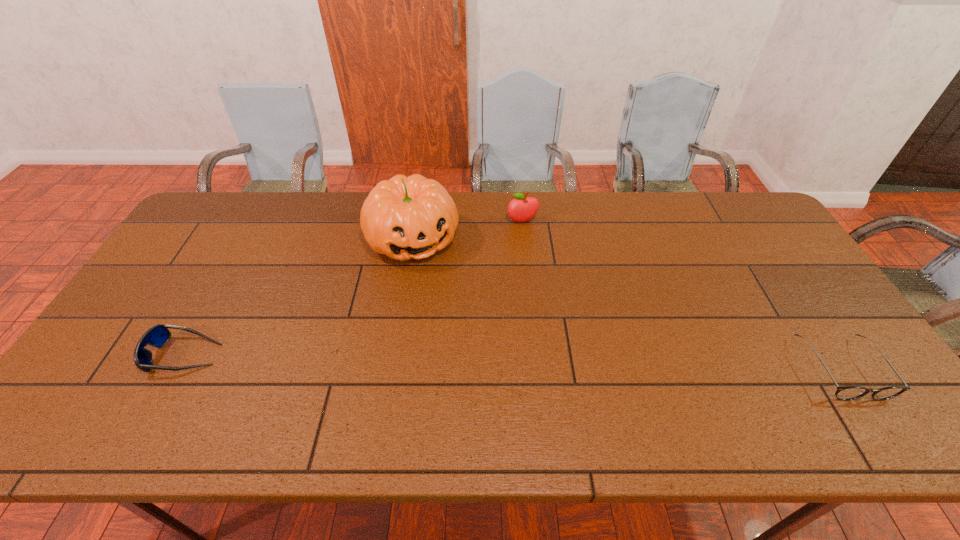
In order to click on object that is at the right edge in this screenshot , I will do `click(845, 393)`.

Find the location of a particular element. This screenshot has height=540, width=960. object at the near left corner is located at coordinates (157, 336).

I want to click on object that is at the near right corner, so pos(845,393).

In the image, there is a desktop. In order to click on vacant area at the far edge in this screenshot , I will do `click(504, 229)`.

Identify the location of vacant area at the near edge of the desktop. (751, 395).

Locate an element on the screen. vacant space at the left edge is located at coordinates (180, 250).

Identify the location of free space at the near left corner of the desktop. (138, 379).

Find the location of a particular element. vacant region at the far right corner of the desktop is located at coordinates (710, 201).

Image resolution: width=960 pixels, height=540 pixels. I want to click on unoccupied area between the sunglasses and the rightmost object, so click(x=513, y=361).

At what (x,y) coordinates should I click in order to perform the action: click on free spot between the rightmost object and the apple. Please return your answer as a coordinate pair (x, y). The width and height of the screenshot is (960, 540). Looking at the image, I should click on (682, 295).